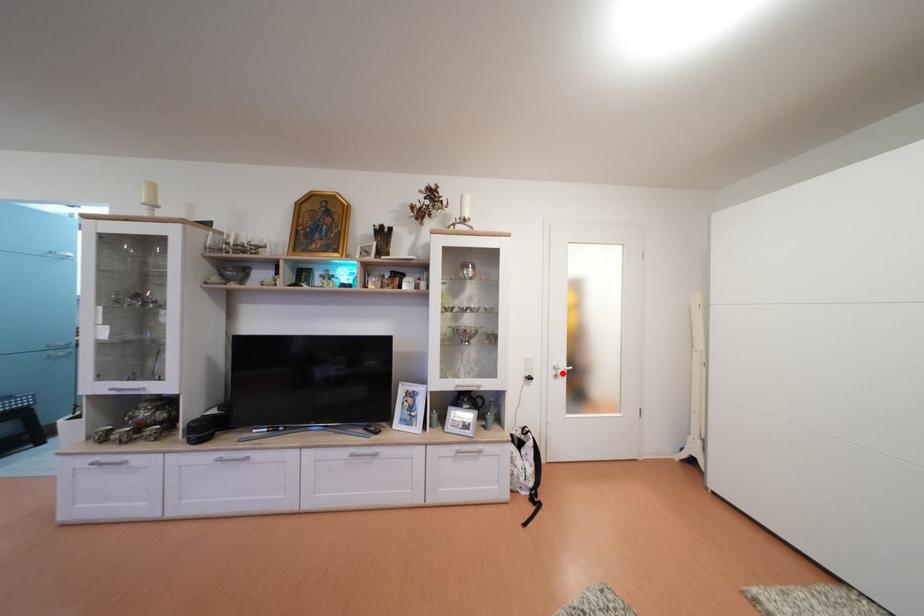
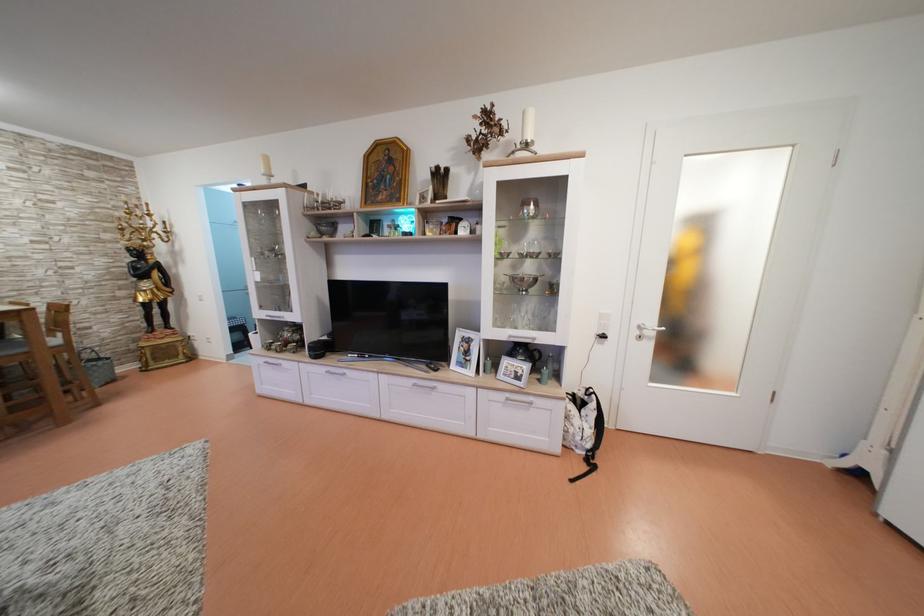
Question: A red point is marked in image1. In image2, is the corresponding 3D point closer to the camera or farther? Reply with the corresponding letter.

Choices:
 (A) The corresponding 3D point is closer.
 (B) The corresponding 3D point is farther.

Answer: (A)